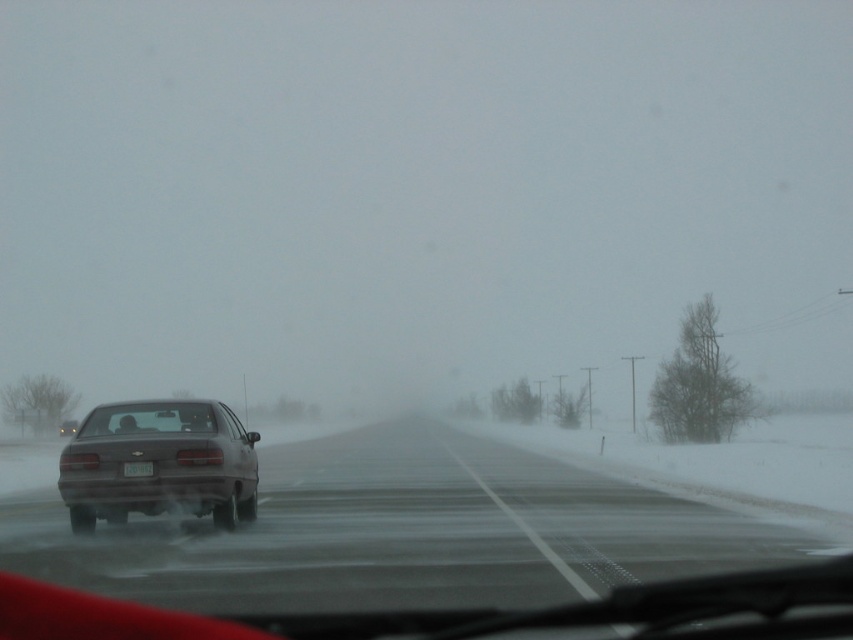
You are driving a car and see the road ahead. There is a point marked at coordinates (160, 464) on your windshield. What does this point indicate?

The point at (160, 464) indicates a matte gray sedan at center.

From the picture: You are driving a car and want to know if the smokey asphalt highway at center is to the left or right of the transparent glass windshield at center. Based on the scene, which side is it on?

The smokey asphalt highway at center is positioned on the right side of transparent glass windshield at center.

You are driving a car and need to maintain a safe distance. The recommended safe distance is 6 meters. Is the distance between the smokey asphalt highway at center and the transparent glass windshield at center sufficient?

The distance between the smokey asphalt highway at center and the transparent glass windshield at center is 7.16 meters, which is greater than the recommended 6 meters. Therefore, the distance is sufficient.